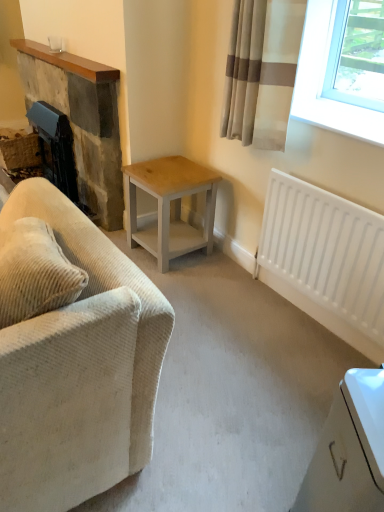
I want to click on free point below white matte radiator at lower right (from a real-world perspective), so click(313, 323).